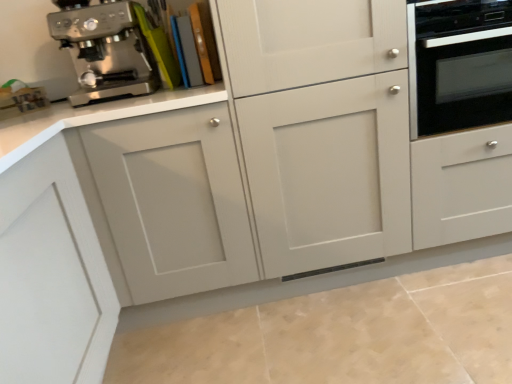
The image size is (512, 384). What do you see at coordinates (459, 64) in the screenshot? I see `black glass oven at right` at bounding box center [459, 64].

You are a GUI agent. You are given a task and a screenshot of the screen. Output one action in this format:
    pyautogui.click(x=<x>, y=<y>)
    Task: Click on the black glass oven at right
    This screenshot has width=512, height=384.
    Given the screenshot: What is the action you would take?
    pyautogui.click(x=459, y=64)

The width and height of the screenshot is (512, 384). Describe the element at coordinates (104, 49) in the screenshot. I see `stainless steel coffee maker at upper left` at that location.

This screenshot has height=384, width=512. Identify the location of stainless steel coffee maker at upper left. (104, 49).

You are a GUI agent. You are given a task and a screenshot of the screen. Output one action in this format:
    pyautogui.click(x=<x>, y=<y>)
    Task: Click on the black glass oven at right
    This screenshot has height=384, width=512.
    Given the screenshot: What is the action you would take?
    pyautogui.click(x=459, y=64)

Considering the relative positions of black glass oven at right and stainless steel coffee maker at upper left in the image provided, is black glass oven at right to the right of stainless steel coffee maker at upper left from the viewer's perspective?

Yes.

Which is behind, black glass oven at right or stainless steel coffee maker at upper left?

Positioned behind is stainless steel coffee maker at upper left.

Which is behind, point (464, 128) or point (75, 7)?

Positioned behind is point (464, 128).

From the image's perspective, does black glass oven at right appear higher than stainless steel coffee maker at upper left?

Actually, black glass oven at right appears below stainless steel coffee maker at upper left in the image.

From a real-world perspective, is black glass oven at right beneath stainless steel coffee maker at upper left?

Yes.

Which of these two, black glass oven at right or stainless steel coffee maker at upper left, is thinner?

With smaller width is stainless steel coffee maker at upper left.

In the scene shown: Considering the relative sizes of black glass oven at right and stainless steel coffee maker at upper left in the image provided, is black glass oven at right shorter than stainless steel coffee maker at upper left?

No.

Which of these two, black glass oven at right or stainless steel coffee maker at upper left, is bigger?

With larger size is black glass oven at right.

Do you think black glass oven at right is within stainless steel coffee maker at upper left, or outside of it?

black glass oven at right is outside stainless steel coffee maker at upper left.

Would you say black glass oven at right is a long distance from stainless steel coffee maker at upper left?

black glass oven at right is positioned a significant distance from stainless steel coffee maker at upper left.

Consider the image. Is black glass oven at right facing towards stainless steel coffee maker at upper left?

No, black glass oven at right does not turn towards stainless steel coffee maker at upper left.

What's the angular difference between black glass oven at right and stainless steel coffee maker at upper left's facing directions?

1.23 degrees.

How much distance is there between black glass oven at right and stainless steel coffee maker at upper left?

black glass oven at right is 6.11 feet away from stainless steel coffee maker at upper left.

Find the location of a particular element. The height and width of the screenshot is (384, 512). home appliance below the stainless steel coffee maker at upper left (from a real-world perspective) is located at coordinates (459, 64).

Is stainless steel coffee maker at upper left to the right of black glass oven at right from the viewer's perspective?

Incorrect, stainless steel coffee maker at upper left is not on the right side of black glass oven at right.

Is the depth of stainless steel coffee maker at upper left less than that of black glass oven at right?

No.

Which is behind, point (104, 77) or point (472, 10)?

Point (104, 77)

From the image's perspective, does stainless steel coffee maker at upper left appear higher than black glass oven at right?

Correct, stainless steel coffee maker at upper left appears higher than black glass oven at right in the image.

From a real-world perspective, which is physically below, stainless steel coffee maker at upper left or black glass oven at right?

From a 3D spatial view, black glass oven at right is below.

Looking at this image, which object is thinner, stainless steel coffee maker at upper left or black glass oven at right?

Thinner between the two is stainless steel coffee maker at upper left.

Does stainless steel coffee maker at upper left have a lesser height compared to black glass oven at right?

Correct, stainless steel coffee maker at upper left is not as tall as black glass oven at right.

Who is bigger, stainless steel coffee maker at upper left or black glass oven at right?

Bigger between the two is black glass oven at right.

Is stainless steel coffee maker at upper left inside or outside of black glass oven at right?

stainless steel coffee maker at upper left exists outside the volume of black glass oven at right.

Is stainless steel coffee maker at upper left with black glass oven at right?

No, stainless steel coffee maker at upper left is not next to black glass oven at right.

Does stainless steel coffee maker at upper left turn towards black glass oven at right?

No.

Can you tell me how much stainless steel coffee maker at upper left and black glass oven at right differ in facing direction?

stainless steel coffee maker at upper left and black glass oven at right are facing 1.23 degrees away from each other.

You are a GUI agent. You are given a task and a screenshot of the screen. Output one action in this format:
    pyautogui.click(x=<x>, y=<y>)
    Task: Click on the coffee maker that appears behind the black glass oven at right
    
    Given the screenshot: What is the action you would take?
    pyautogui.click(x=104, y=49)

What are the coordinates of `home appliance that is below the stainless steel coffee maker at upper left (from the image's perspective)` in the screenshot? It's located at (459, 64).

At what (x,y) coordinates should I click in order to perform the action: click on coffee maker that appears behind the black glass oven at right. Please return your answer as a coordinate pair (x, y). The image size is (512, 384). Looking at the image, I should click on (104, 49).